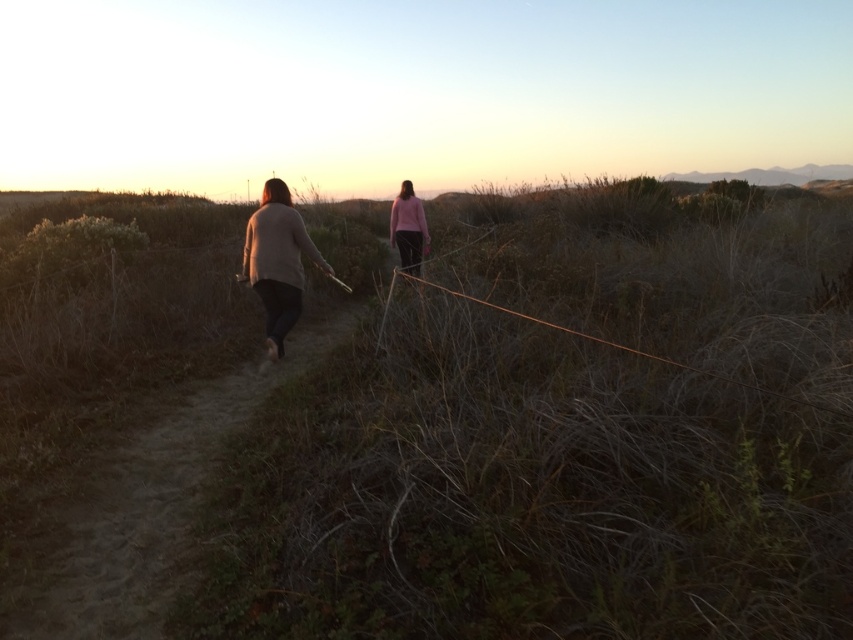
You are planning to walk along the dirt path at center while wearing the pink matte sweater at center. Considering their heights, which one is taller?

The pink matte sweater at center is taller than the dirt path at center.

You are standing at the point with coordinates (450, 426) in the image. What is the terrain like at this location?

The terrain at point (450, 426) is brown dry grass at center.